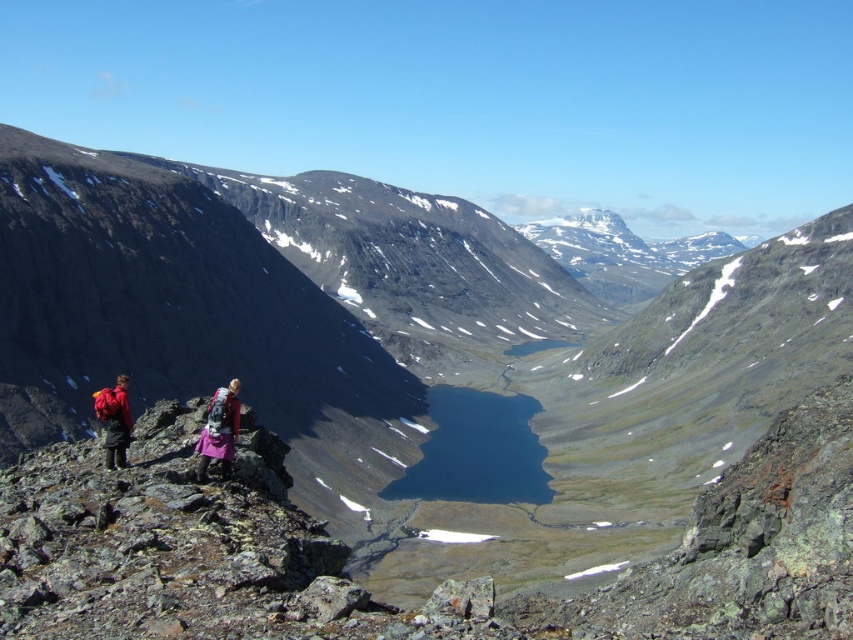
Question: Can you confirm if purple fabric backpack at lower left is wider than matte red backpack at left?

Choices:
 (A) no
 (B) yes

Answer: (A)

Question: Is purple fabric backpack at lower left bigger than matte red backpack at left?

Choices:
 (A) no
 (B) yes

Answer: (B)

Question: Which of the following is the closest to the observer?

Choices:
 (A) matte red backpack at left
 (B) purple fabric backpack at lower left

Answer: (B)

Question: Does purple fabric backpack at lower left have a larger size compared to matte red backpack at left?

Choices:
 (A) no
 (B) yes

Answer: (B)

Question: Among these objects, which one is farthest from the camera?

Choices:
 (A) purple fabric backpack at lower left
 (B) matte red backpack at left

Answer: (B)